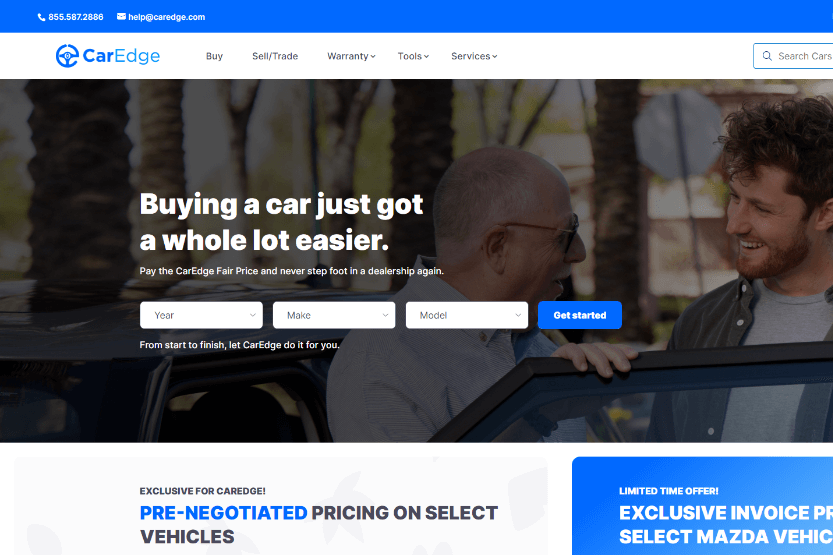
This screenshot has height=555, width=833. In order to click on seat in this screenshot , I will do `click(237, 448)`.